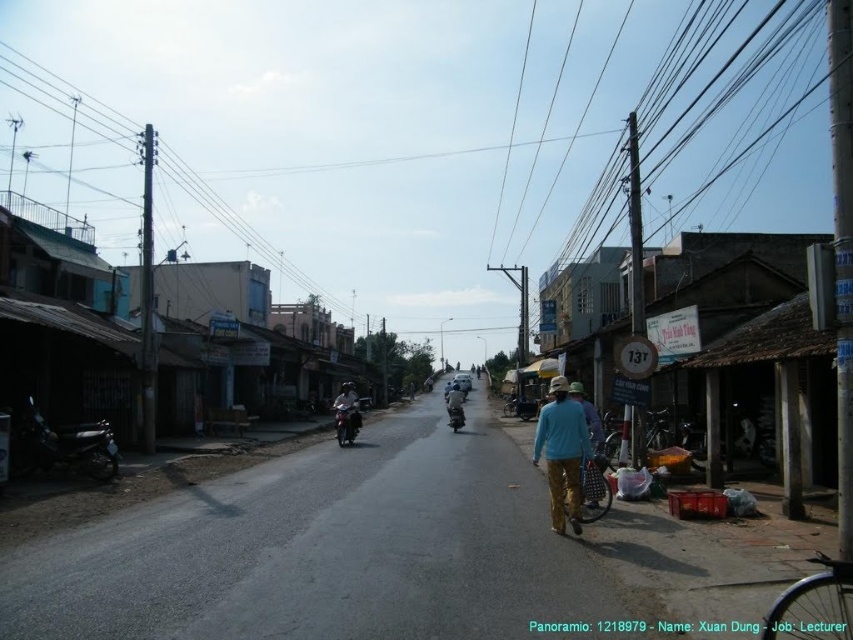
Question: Is matte white motorcycle at center closer to the viewer compared to shiny black motorcycle at center?

Choices:
 (A) no
 (B) yes

Answer: (A)

Question: Is matte white motorcycle at center in front of shiny black motorcycle at center?

Choices:
 (A) yes
 (B) no

Answer: (B)

Question: Does matte white motorcycle at center have a larger size compared to shiny black motorcycle at center?

Choices:
 (A) yes
 (B) no

Answer: (A)

Question: Which point is farther from the camera taking this photo?

Choices:
 (A) (64, 220)
 (B) (79, 458)

Answer: (A)

Question: Which object is positioned farthest from the matte white motorcycle at center?

Choices:
 (A) shiny black motorcycle at left
 (B) blue fabric bag at center
 (C) matte black motorcycle at center
 (D) metallic wire at upper left

Answer: (D)

Question: Estimate the real-world distances between objects in this image. Which object is closer to the blue fabric bag at center?

Choices:
 (A) matte black motorcycle at center
 (B) light blue fabric shirt at center
 (C) matte white motorcycle at center

Answer: (B)